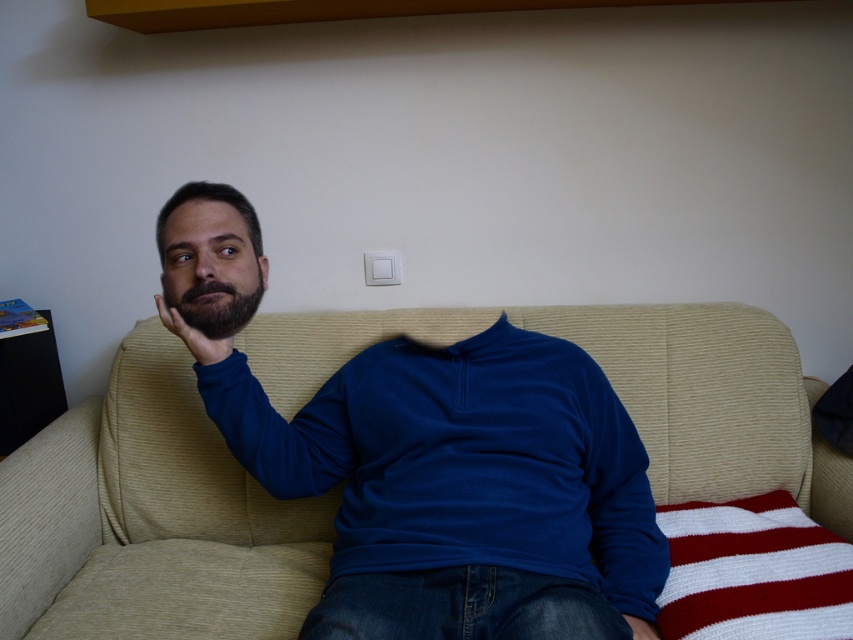
Is beige corduroy couch at center positioned in front of matte skin hand at center?

That is True.

Who is more distant from viewer, (120, 557) or (195, 332)?

The point (120, 557) is more distant.

Is point (238, 483) positioned behind point (228, 353)?

Yes, it is behind point (228, 353).

Identify the location of beige corduroy couch at center. (151, 518).

Is blue cotton shirt at center shorter than matte skin hand at center?

In fact, blue cotton shirt at center may be taller than matte skin hand at center.

Which is behind, point (628, 532) or point (218, 358)?

Point (218, 358)

Is point (546, 340) in front of point (175, 328)?

No.

Where is `blue cotton shirt at center`? The image size is (853, 640). blue cotton shirt at center is located at coordinates (462, 488).

Is beige corduroy couch at center shorter than blue cotton shirt at center?

Indeed, beige corduroy couch at center has a lesser height compared to blue cotton shirt at center.

In order to click on beige corduroy couch at center in this screenshot , I will do `click(151, 518)`.